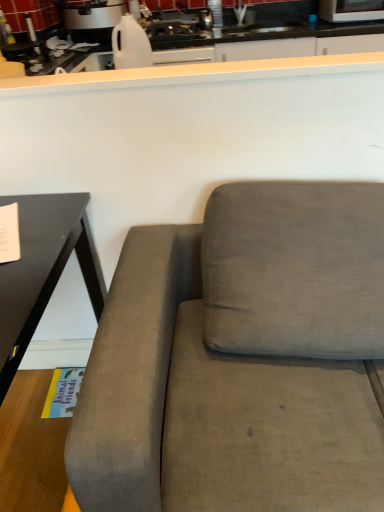
Question: From the image's perspective, is white smooth countertop at upper center above metallic silver microwave at upper right, the 2th appliance in the left-to-right sequence?

Choices:
 (A) yes
 (B) no

Answer: (B)

Question: Is white smooth countertop at upper center shorter than metallic silver microwave at upper right, the 2th appliance in the left-to-right sequence?

Choices:
 (A) yes
 (B) no

Answer: (A)

Question: Does white smooth countertop at upper center have a larger size compared to metallic silver microwave at upper right, the 2th appliance in the left-to-right sequence?

Choices:
 (A) yes
 (B) no

Answer: (B)

Question: Is white smooth countertop at upper center further to camera compared to metallic silver microwave at upper right, the 2th appliance in the left-to-right sequence?

Choices:
 (A) no
 (B) yes

Answer: (A)

Question: Is white smooth countertop at upper center smaller than metallic silver microwave at upper right, the 2th appliance in the left-to-right sequence?

Choices:
 (A) no
 (B) yes

Answer: (B)

Question: Which is correct: matte gray couch at center is inside metallic silver microwave at upper right, which is counted as the first appliance, starting from the right, or outside of it?

Choices:
 (A) inside
 (B) outside

Answer: (B)

Question: From a real-world perspective, is matte gray couch at center physically located above or below metallic silver microwave at upper right, the 2th appliance in the left-to-right sequence?

Choices:
 (A) above
 (B) below

Answer: (B)

Question: From the image's perspective, is matte gray couch at center positioned above or below metallic silver microwave at upper right, which is counted as the first appliance, starting from the right?

Choices:
 (A) below
 (B) above

Answer: (A)

Question: In the image, is matte gray couch at center on the left side or the right side of metallic silver microwave at upper right, the 2th appliance in the left-to-right sequence?

Choices:
 (A) right
 (B) left

Answer: (B)

Question: Does point (81, 62) appear closer or farther from the camera than point (327, 10)?

Choices:
 (A) closer
 (B) farther

Answer: (A)

Question: From the image's perspective, relative to metallic silver microwave at upper right, the 2th appliance in the left-to-right sequence, is white smooth countertop at upper center above or below?

Choices:
 (A) above
 (B) below

Answer: (B)

Question: In terms of width, does white smooth countertop at upper center look wider or thinner when compared to metallic silver microwave at upper right, which is counted as the first appliance, starting from the right?

Choices:
 (A) thin
 (B) wide

Answer: (A)

Question: Looking at the image, does white smooth countertop at upper center seem bigger or smaller compared to metallic silver microwave at upper right, the 2th appliance in the left-to-right sequence?

Choices:
 (A) big
 (B) small

Answer: (B)

Question: In terms of width, does matte gray couch at center look wider or thinner when compared to white smooth countertop at upper center?

Choices:
 (A) thin
 (B) wide

Answer: (B)

Question: Considering the positions of matte gray couch at center and white smooth countertop at upper center in the image, is matte gray couch at center taller or shorter than white smooth countertop at upper center?

Choices:
 (A) short
 (B) tall

Answer: (B)